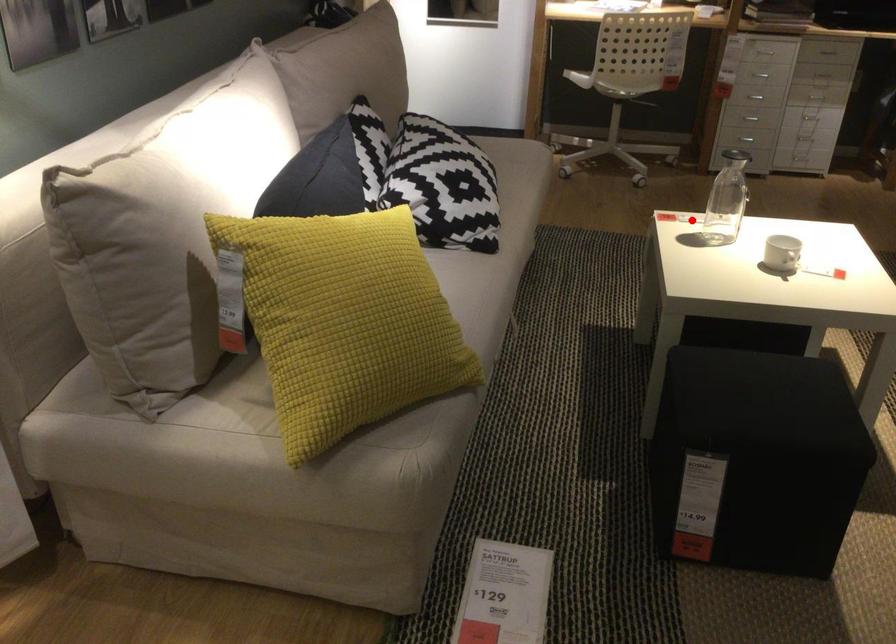
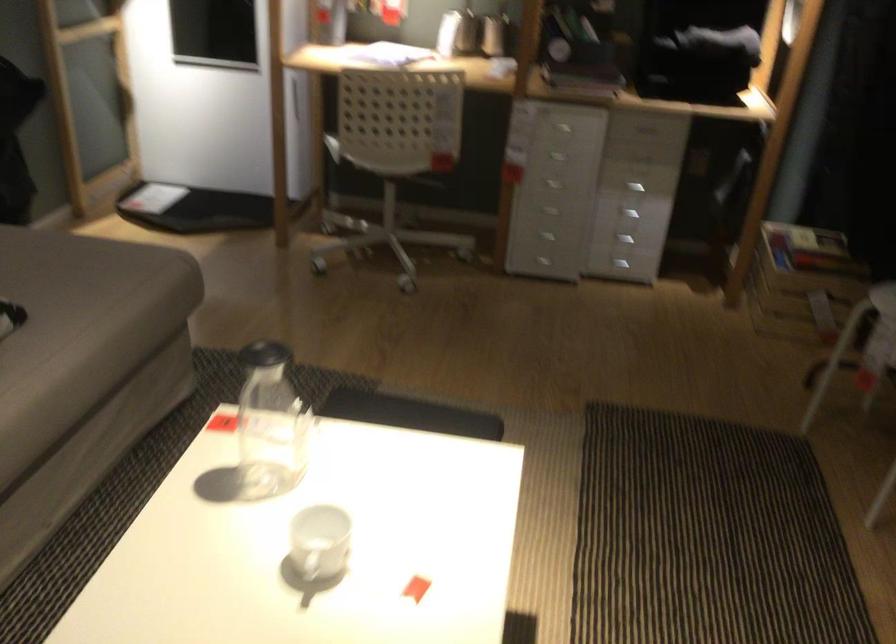
Locate, in the second image, the point that corresponds to the highlighted location in the first image.

(270, 424)